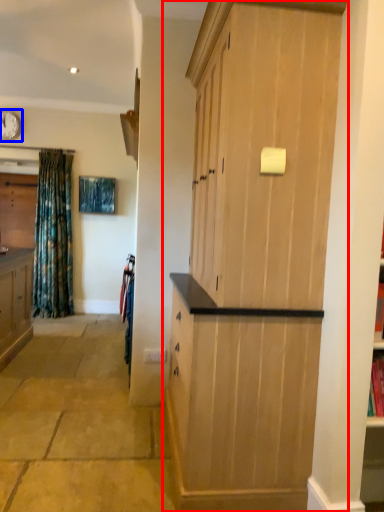
Question: Which of the following is the farthest to the observer, cupboard (highlighted by a red box) or clock (highlighted by a blue box)?

Choices:
 (A) cupboard
 (B) clock

Answer: (B)